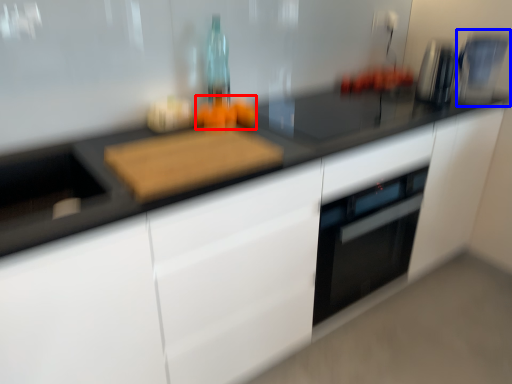
Question: Among these objects, which one is farthest to the camera, food (highlighted by a red box) or coffee machine (highlighted by a blue box)?

Choices:
 (A) food
 (B) coffee machine

Answer: (B)